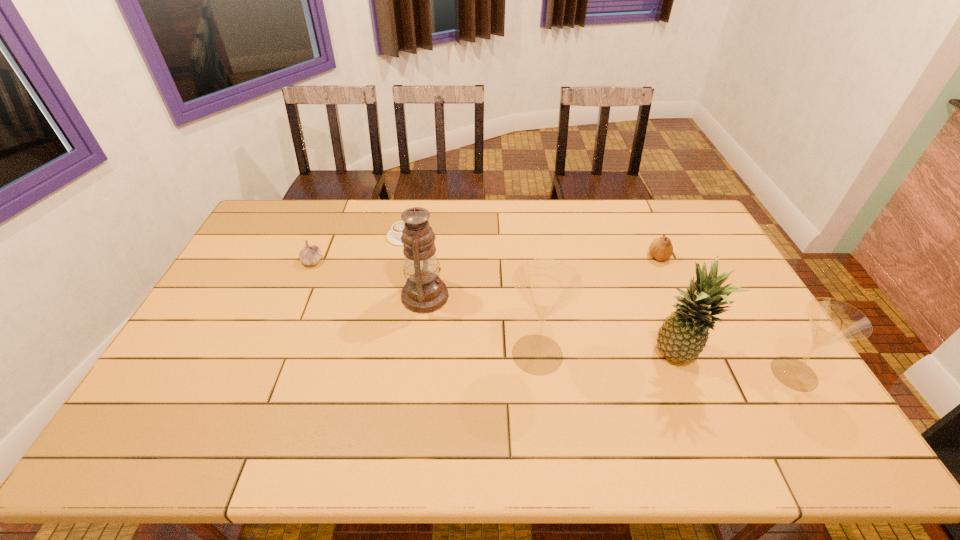
This screenshot has height=540, width=960. What are the coordinates of `vacant space that satisfies the following two spatial constraints: 1. on the back side of the oil lamp; 2. on the left side of the pear` in the screenshot? It's located at (430, 257).

Identify the location of free location that satisfies the following two spatial constraints: 1. on the front side of the leftmost object; 2. on the left side of the pineapple. (272, 357).

This screenshot has width=960, height=540. In order to click on free spot that satisfies the following two spatial constraints: 1. on the back side of the garlic; 2. on the right side of the pear in this screenshot , I will do `click(314, 257)`.